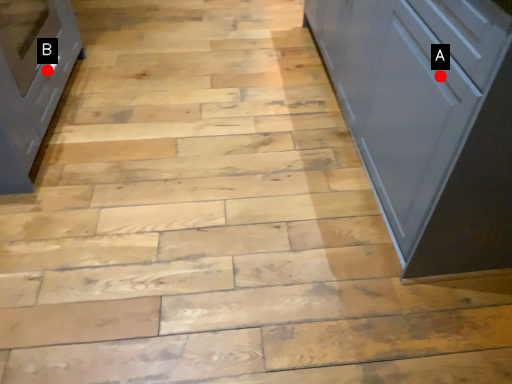
Question: Two points are circled on the image, labeled by A and B beside each circle. Among these points, which one is nearest to the camera?

Choices:
 (A) A is closer
 (B) B is closer

Answer: (A)